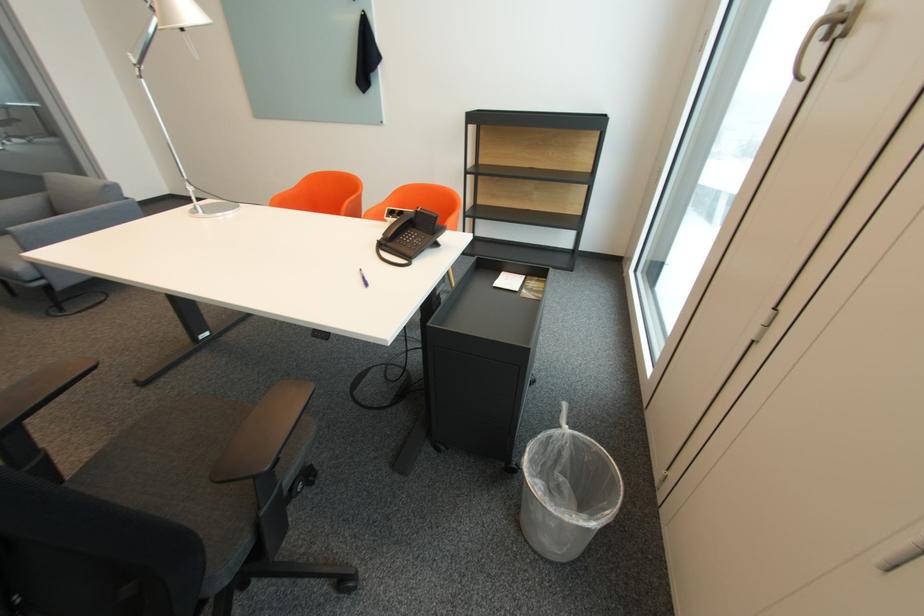
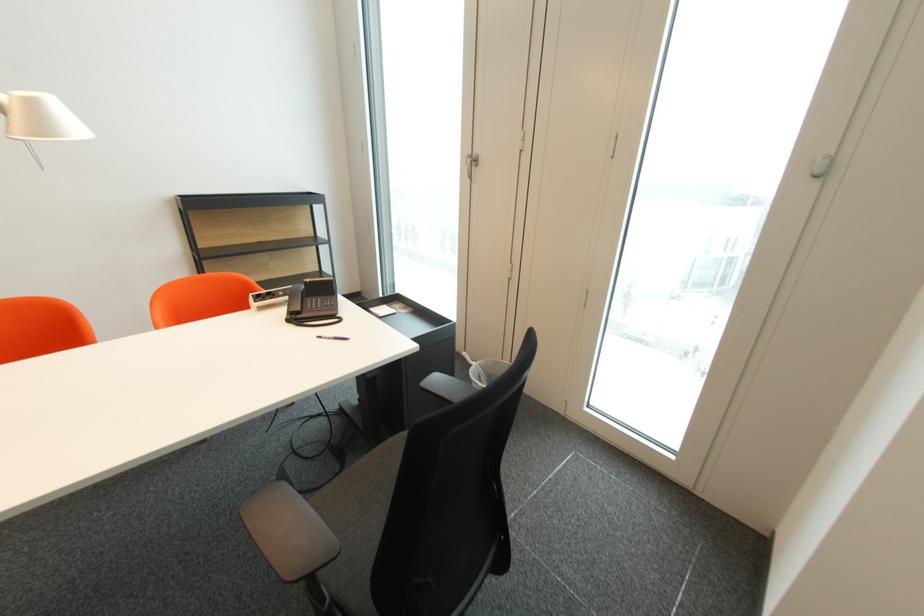
Locate, in the second image, the point that corresponds to point (573, 428) in the first image.

(480, 363)